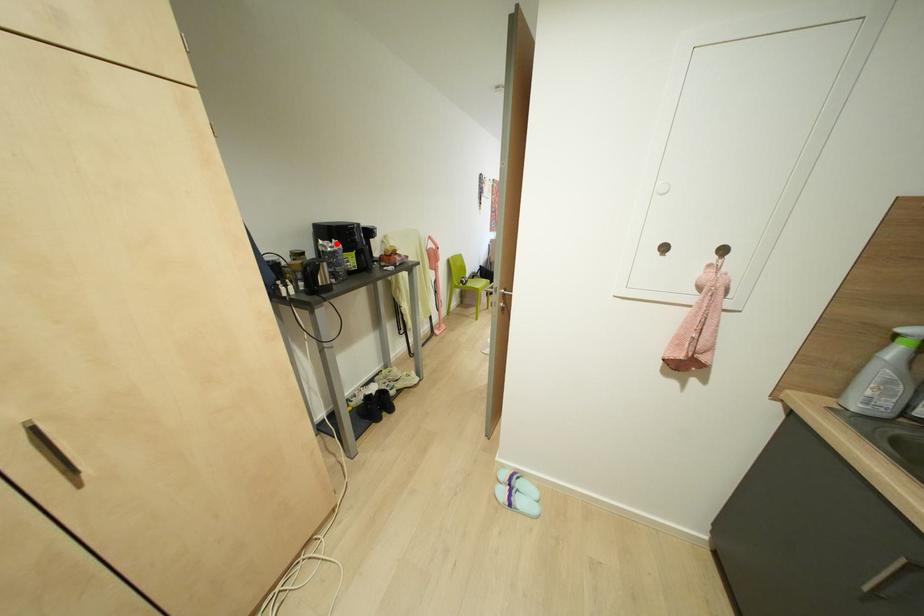
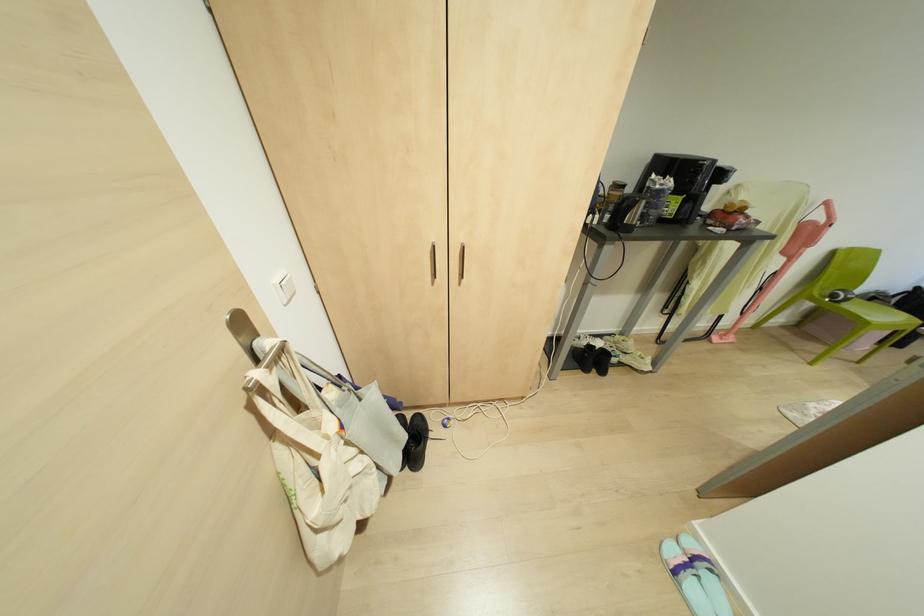
Find the pixel in the second image that matches the highlighted location in the first image.

(670, 182)